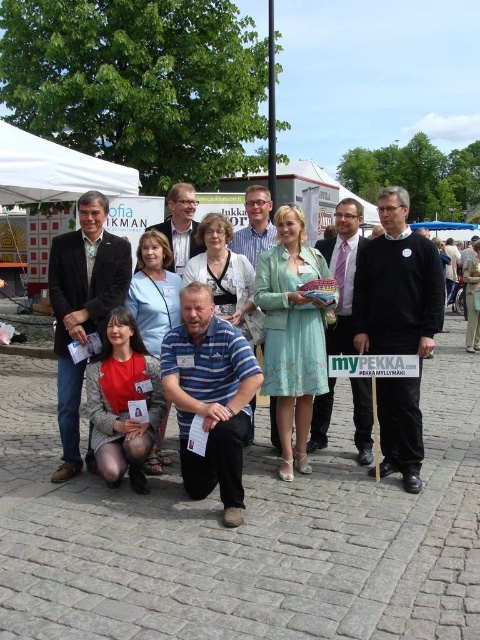
Question: Among these points, which one is farthest from the camera?

Choices:
 (A) (47, 196)
 (B) (312, 172)
 (C) (430, 227)

Answer: (C)

Question: Which of the following is the farthest from the observer?

Choices:
 (A) light blue fabric dress at center
 (B) blue fabric canopy at upper center
 (C) white fabric canopy at upper left
 (D) white fabric canopy at upper center

Answer: (B)

Question: Can you confirm if light blue fabric dress at center is positioned below white fabric canopy at upper center?

Choices:
 (A) no
 (B) yes

Answer: (B)

Question: Which point appears closest to the camera in this image?

Choices:
 (A) (362, 202)
 (B) (396, 310)

Answer: (B)

Question: Can you confirm if white fabric canopy at upper left is positioned to the left of blue fabric canopy at upper center?

Choices:
 (A) yes
 (B) no

Answer: (A)

Question: Does white fabric canopy at upper left come in front of white fabric canopy at upper center?

Choices:
 (A) yes
 (B) no

Answer: (A)